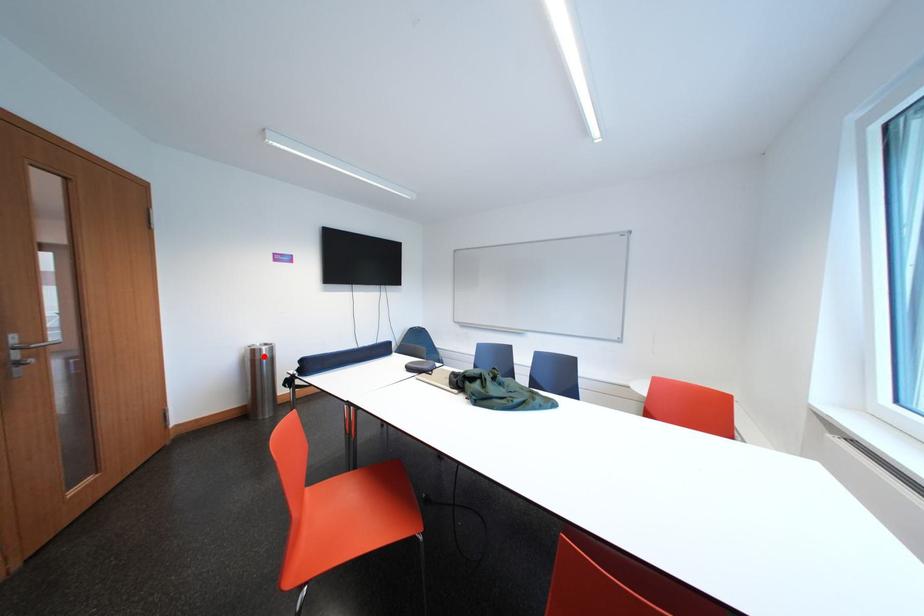
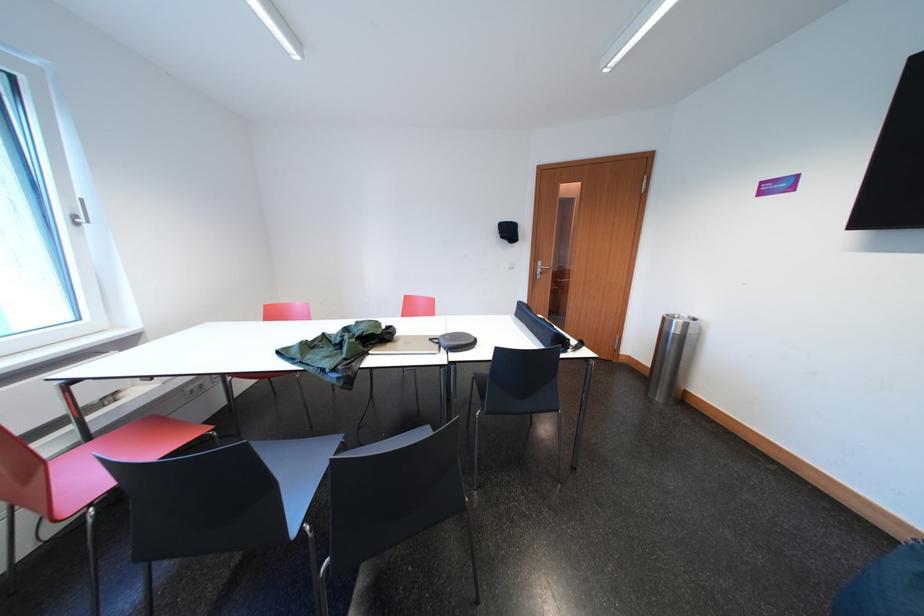
Locate, in the second image, the point that corresponds to the highlighted location in the first image.

(672, 323)